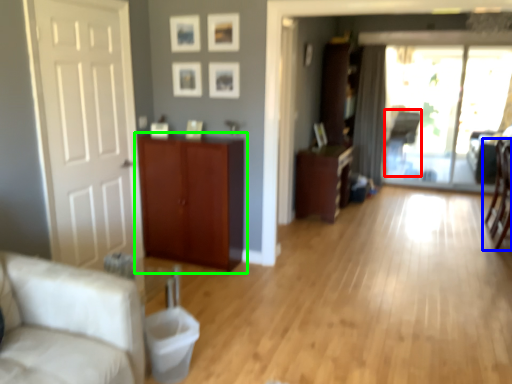
Question: Estimate the real-world distances between objects in this image. Which object is farther from armchair (highlighted by a red box), chair (highlighted by a blue box) or cabinetry (highlighted by a green box)?

Choices:
 (A) chair
 (B) cabinetry

Answer: (B)